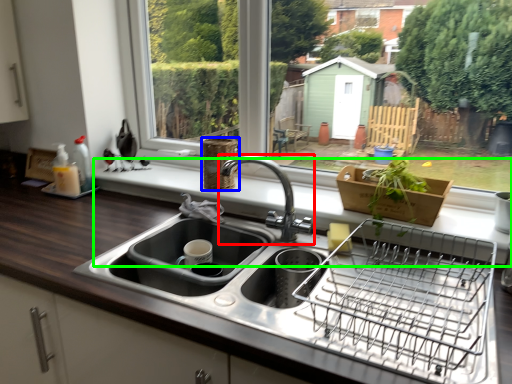
Question: Estimate the real-world distances between objects in this image. Which object is closer to tap (highlighted by a red box), basket (highlighted by a blue box) or window sill (highlighted by a green box)?

Choices:
 (A) basket
 (B) window sill

Answer: (A)